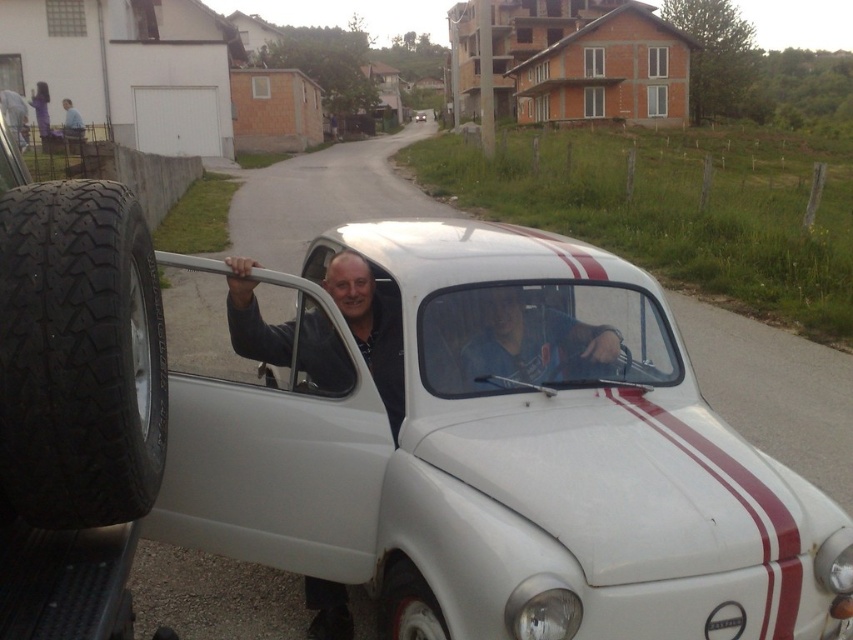
You are a delivery driver who needs to load both the black rubber tire at left and the purple fabric dress at upper left into your truck. Which item should you load first if you want to place the larger item at the bottom?

The purple fabric dress at upper left is larger than the black rubber tire at left, so you should load the purple fabric dress at upper left first to place it at the bottom.

You are a photographer standing in front of the white matte car at center and the purple fabric dress at upper left. Which object is taller?

The purple fabric dress at upper left is taller than the white matte car at center.

Based on the photo, you are a photographer trying to capture both the purple fabric dress at upper left and the white matte car at center in a single frame. Based on their sizes, which object should you focus on to ensure both fit in the photo?

The purple fabric dress at upper left is wider than the white matte car at center. To ensure both fit in the photo, focus on the purple fabric dress at upper left as it requires more horizontal space.